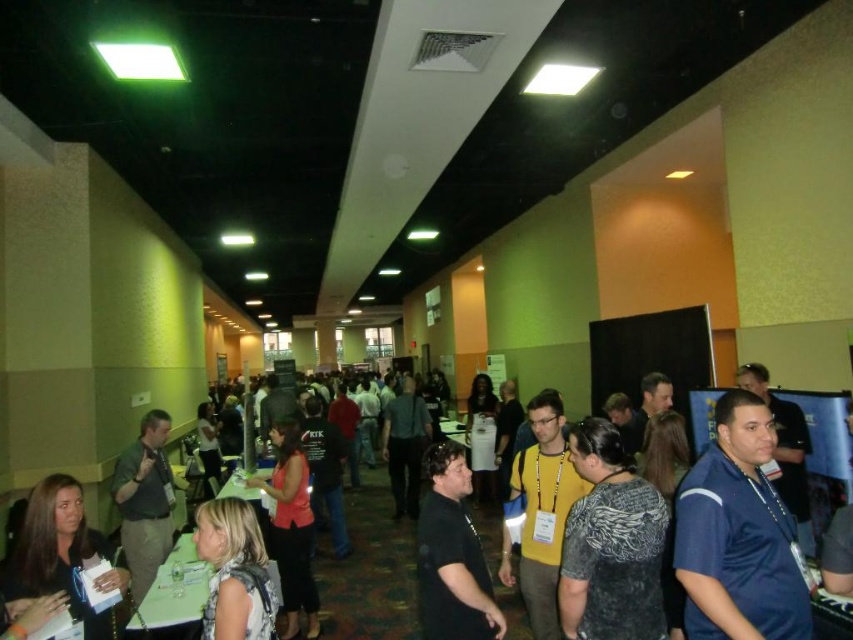
You are an event organizer at the convention and need to decide which attendee is more noticeable based on their clothing. Which of the following is more noticeable in the scene? blue jersey at center or black matte shirt at center

The blue jersey at center is bigger than the black matte shirt at center, making it more noticeable.

You are an attendee at the convention and you notice two clothing items at the center of the corridor. The blue jersey at center and the black matte shirt at center. Which clothing item is covering the other one?

The blue jersey at center is positioned over the black matte shirt at center, so it is covering the black matte shirt at center.